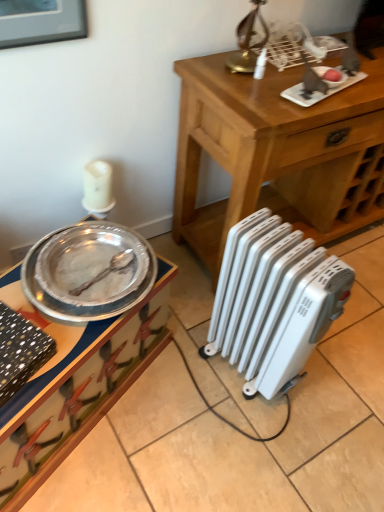
Question: Should I look upward or downward to see white plastic radiator at lower right?

Choices:
 (A) up
 (B) down

Answer: (B)

Question: Can you confirm if wooden table at center is smaller than white plastic radiator at lower right?

Choices:
 (A) no
 (B) yes

Answer: (A)

Question: Is wooden table at center not close to white plastic radiator at lower right?

Choices:
 (A) no
 (B) yes

Answer: (A)

Question: Is wooden table at center at the right side of white plastic radiator at lower right?

Choices:
 (A) yes
 (B) no

Answer: (A)

Question: From a real-world perspective, is wooden table at center on top of white plastic radiator at lower right?

Choices:
 (A) no
 (B) yes

Answer: (B)

Question: Is the position of wooden table at center more distant than that of white plastic radiator at lower right?

Choices:
 (A) yes
 (B) no

Answer: (A)

Question: From the image's perspective, is wooden table at center on top of white plastic radiator at lower right?

Choices:
 (A) yes
 (B) no

Answer: (A)

Question: Can you confirm if brushed metal picture frame at upper left is taller than white plastic radiator at lower right?

Choices:
 (A) yes
 (B) no

Answer: (B)

Question: From a real-world perspective, is brushed metal picture frame at upper left positioned over white plastic radiator at lower right based on gravity?

Choices:
 (A) no
 (B) yes

Answer: (B)

Question: Is brushed metal picture frame at upper left surrounding white plastic radiator at lower right?

Choices:
 (A) yes
 (B) no

Answer: (B)

Question: Is brushed metal picture frame at upper left placed right next to white plastic radiator at lower right?

Choices:
 (A) yes
 (B) no

Answer: (B)

Question: From the image's perspective, is brushed metal picture frame at upper left under white plastic radiator at lower right?

Choices:
 (A) no
 (B) yes

Answer: (A)

Question: Is brushed metal picture frame at upper left outside white plastic radiator at lower right?

Choices:
 (A) yes
 (B) no

Answer: (A)

Question: Can you confirm if wooden table at center is positioned to the right of metallic silver tray at left?

Choices:
 (A) yes
 (B) no

Answer: (A)